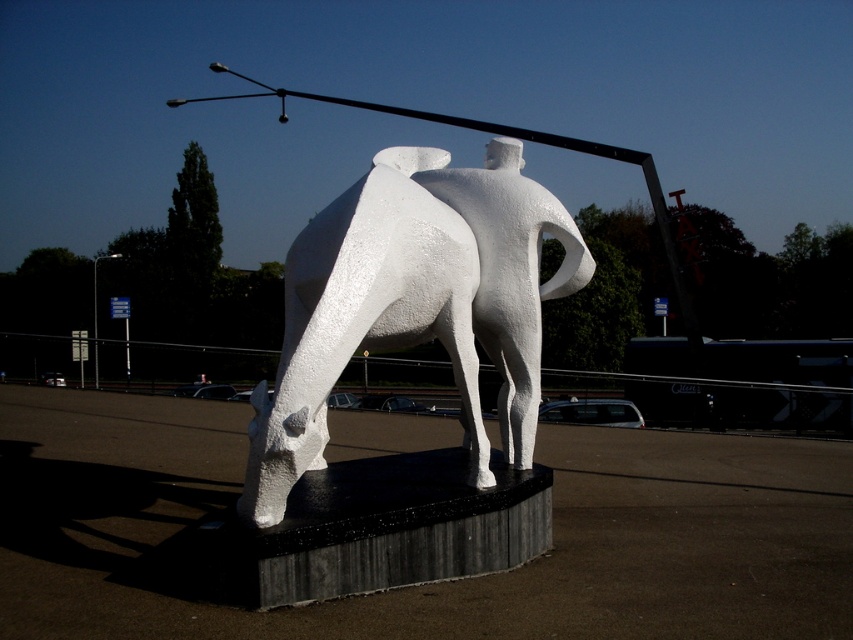
Question: Does white matte sculpture at center appear over metallic pole at left?

Choices:
 (A) no
 (B) yes

Answer: (A)

Question: Among these objects, which one is nearest to the camera?

Choices:
 (A) white matte sculpture at center
 (B) metallic pole at left

Answer: (A)

Question: Does white matte sculpture at center appear under metallic pole at left?

Choices:
 (A) yes
 (B) no

Answer: (A)

Question: Which object appears farthest from the camera in this image?

Choices:
 (A) metallic pole at left
 (B) white matte sculpture at center

Answer: (A)

Question: Can you confirm if white matte sculpture at center is thinner than metallic pole at left?

Choices:
 (A) yes
 (B) no

Answer: (A)